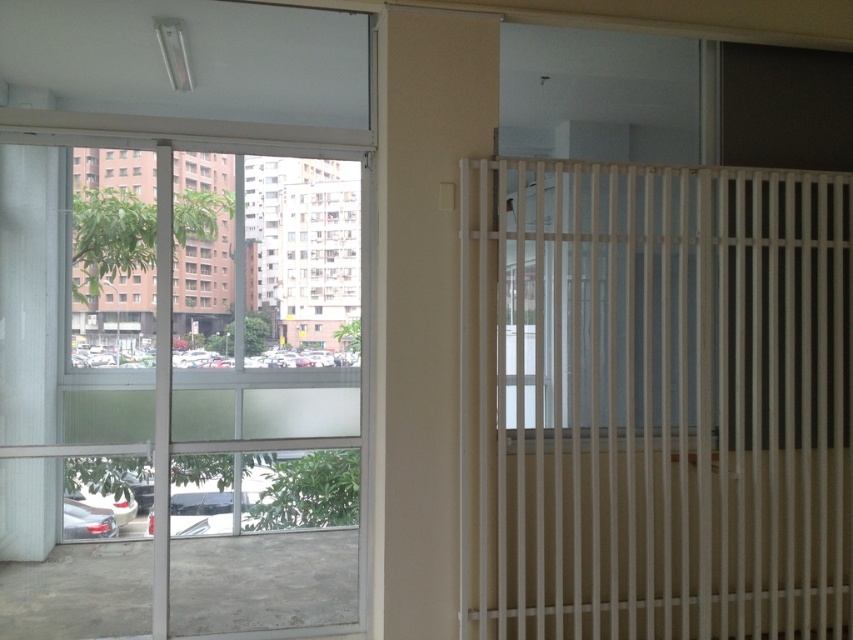
You are standing in the room shown in the image. There is a point marked at coordinates (656, 401). Which object does this point belong to?

The point at (656, 401) is on the white wood radiator at upper right.

You are standing in the room and want to move from the point at coordinates [827,550] to the point at coordinates [136,349]. Which direction should you move to get closer to your destination?

You should move towards the bottom left direction because point [136,349] is closer to the camera than point [827,550], so moving in that direction would bring you closer to the destination.

You are a delivery person carrying a package that is 1.5 meters long. You need to move it through the space between the white wood radiator at upper right and the transparent glass door at left. Can the package fit through that space?

The distance between the white wood radiator at upper right and the transparent glass door at left is 1.56 meters. Since the package is 1.5 meters long, it can fit through the space as the available distance is slightly larger than the package length.